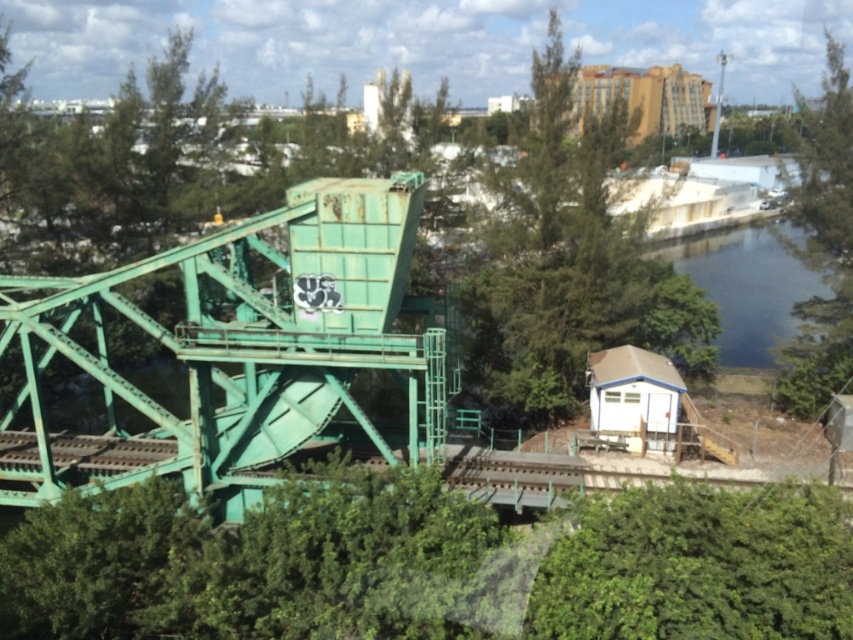
Question: Can you confirm if green leafy tree at center is positioned below green leafy tree at right?

Choices:
 (A) no
 (B) yes

Answer: (A)

Question: Among these points, which one is nearest to the camera?

Choices:
 (A) (512, 216)
 (B) (271, 412)
 (C) (840, 285)

Answer: (B)

Question: Does green leafy tree at center have a larger size compared to green leafy tree at right?

Choices:
 (A) yes
 (B) no

Answer: (B)

Question: Which of the following is the farthest from the observer?

Choices:
 (A) click(x=714, y=275)
 (B) click(x=825, y=188)

Answer: (A)

Question: Which of the following is the farthest from the observer?

Choices:
 (A) (656, 266)
 (B) (816, 128)
 (C) (320, 196)

Answer: (A)

Question: Does green leafy tree at center appear over green leafy tree at right?

Choices:
 (A) no
 (B) yes

Answer: (B)